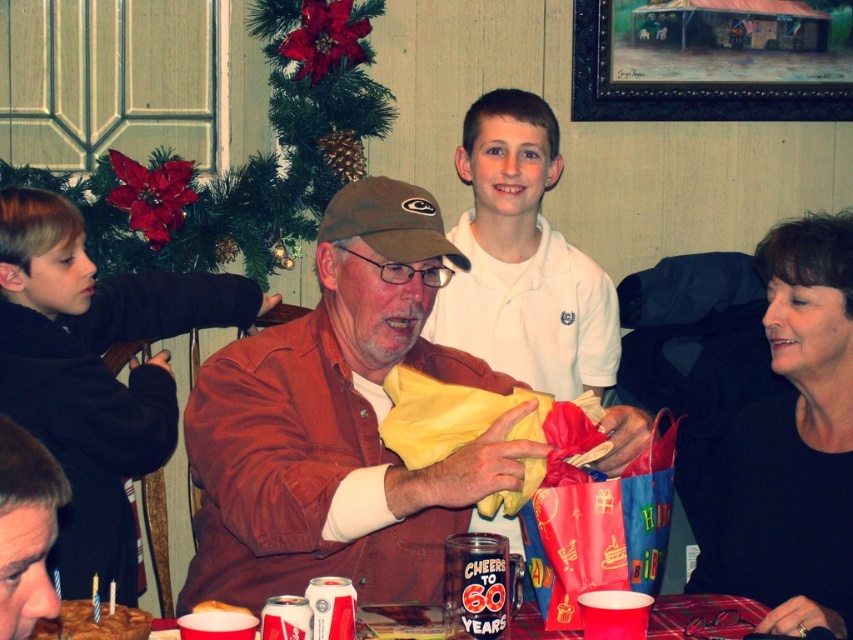
You are a guest at this birthday celebration and want to grab a slice of the chocolate cake with frosting at lower left. However, there is a black fleece jacket at left in your way. Based on their positions, can you reach the cake without moving the jacket?

The black fleece jacket at left is to the left of the chocolate cake with frosting at lower left, so the jacket is blocking your path to the cake. You will need to move the jacket to access the cake.

You are a guest at this birthday party and you want to know which clothing item is shorter between the brown leather jacket at center and the white smooth shirt at upper center. Can you tell me?

The brown leather jacket at center is not as tall as the white smooth shirt at upper center, so the brown leather jacket at center is shorter.